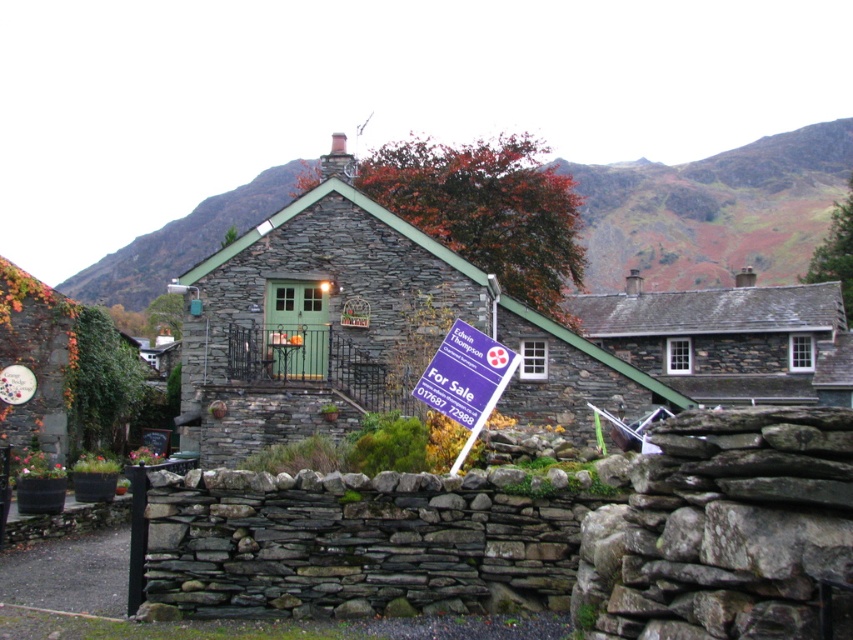
You are a visitor approaching the stone slate cottage at center and notice the white plastic sign at center. From your perspective, which object is closer to you?

The stone slate cottage at center is closer to you because the white plastic sign at center is positioned behind it.

You are standing at the point marked by the coordinate point at (363, 330). What structure are you directly in front of?

The point at (363, 330) marks the stone slate cottage at center, so you are directly in front of the stone slate cottage at center.